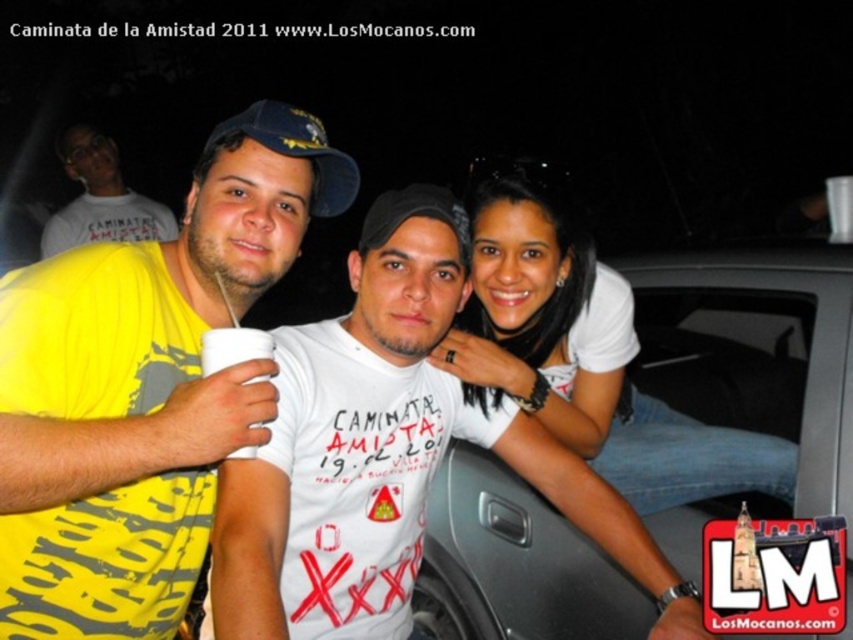
Question: Among these objects, which one is nearest to the camera?

Choices:
 (A) white matte shirt at center
 (B) blue fabric baseball cap at center
 (C) yellow matte t-shirt at left
 (D) white matte t-shirt at upper left

Answer: (C)

Question: Can you confirm if yellow matte t-shirt at left is positioned below white matte t-shirt at upper left?

Choices:
 (A) yes
 (B) no

Answer: (A)

Question: Among these points, which one is farthest from the camera?

Choices:
 (A) (322, 131)
 (B) (581, 305)
 (C) (299, 209)
 (D) (100, 221)

Answer: (D)

Question: Based on their relative distances, which object is nearer to the white matte shirt at center?

Choices:
 (A) yellow matte t-shirt at left
 (B) blue fabric baseball cap at center
 (C) white matte t-shirt at upper left

Answer: (A)

Question: Does yellow matte t-shirt at left appear over blue fabric baseball cap at center?

Choices:
 (A) yes
 (B) no

Answer: (B)

Question: Is white matte shirt at center further to the viewer compared to blue fabric baseball cap at center?

Choices:
 (A) no
 (B) yes

Answer: (B)